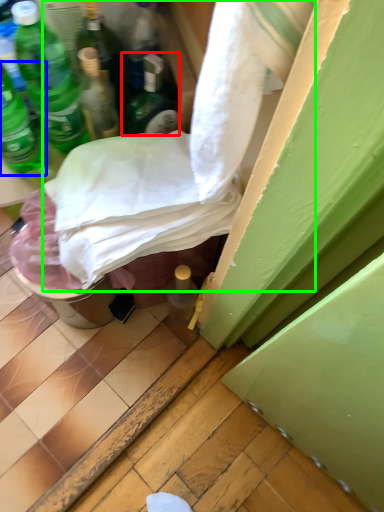
Question: Based on their relative distances, which object is farther from bottle (highlighted by a red box)? Choose from bottle (highlighted by a blue box) and sheet (highlighted by a green box).

Choices:
 (A) bottle
 (B) sheet

Answer: (A)